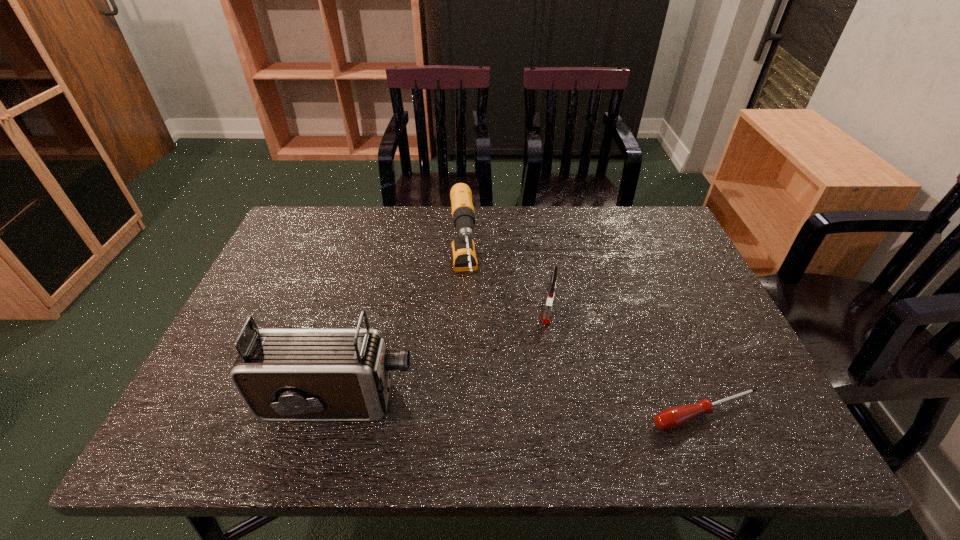
At what (x,y) coordinates should I click in order to perform the action: click on free point located 0.160m on the handle side of the drill. Please return your answer as a coordinate pair (x, y). This screenshot has width=960, height=540. Looking at the image, I should click on (468, 380).

Where is `free location located 0.070m on the handle side of the drill`? free location located 0.070m on the handle side of the drill is located at coordinates (466, 347).

Locate an element on the screen. The image size is (960, 540). free location located on the handle side of the drill is located at coordinates (465, 340).

Where is `object positioned at the far edge`? object positioned at the far edge is located at coordinates (464, 255).

You are a GUI agent. You are given a task and a screenshot of the screen. Output one action in this format:
    pyautogui.click(x=<x>, y=<y>)
    Task: Click on the camcorder that is at the near edge
    This screenshot has height=540, width=960.
    Given the screenshot: What is the action you would take?
    pyautogui.click(x=282, y=374)

At what (x,y) coordinates should I click in order to perform the action: click on screwdriver located at the near edge. Please return your answer as a coordinate pair (x, y). Image resolution: width=960 pixels, height=540 pixels. Looking at the image, I should click on (671, 418).

The width and height of the screenshot is (960, 540). I want to click on object located in the left edge section of the desktop, so click(x=282, y=374).

Find the location of `object that is positioned at the right edge`. object that is positioned at the right edge is located at coordinates (671, 418).

This screenshot has width=960, height=540. I want to click on object that is at the near left corner, so click(282, 374).

The width and height of the screenshot is (960, 540). I want to click on object present at the near right corner, so click(671, 418).